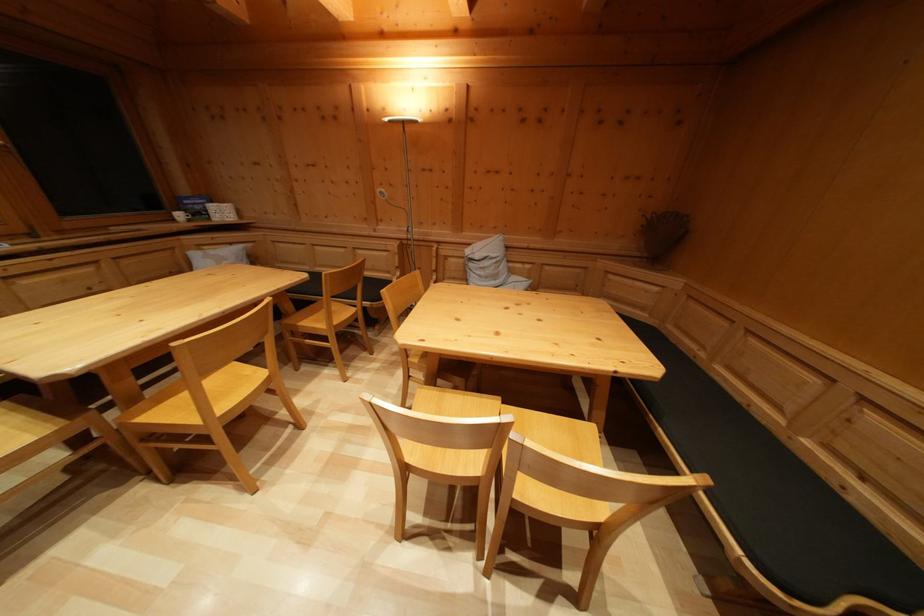
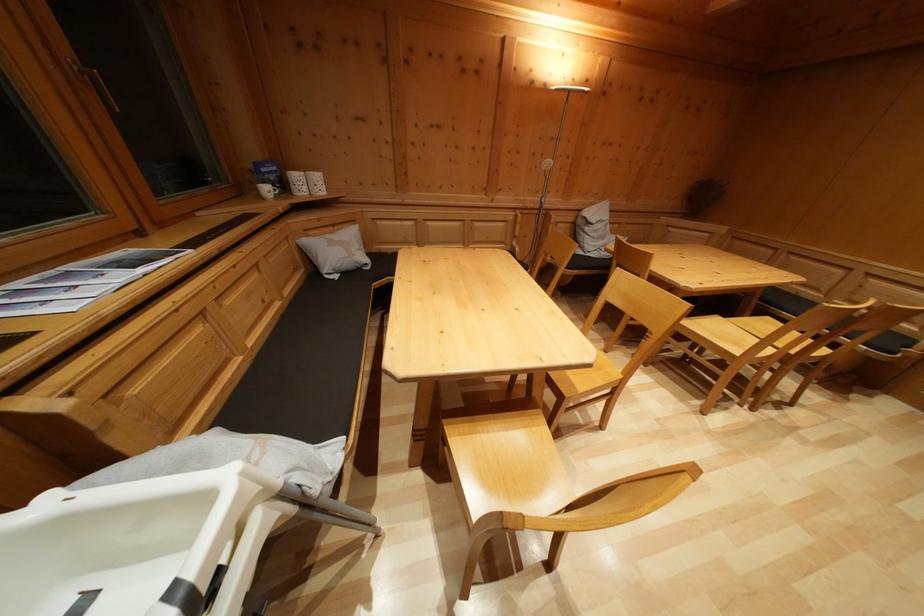
The point at (237, 251) is marked in the first image. Where is the corresponding point in the second image?

(338, 233)